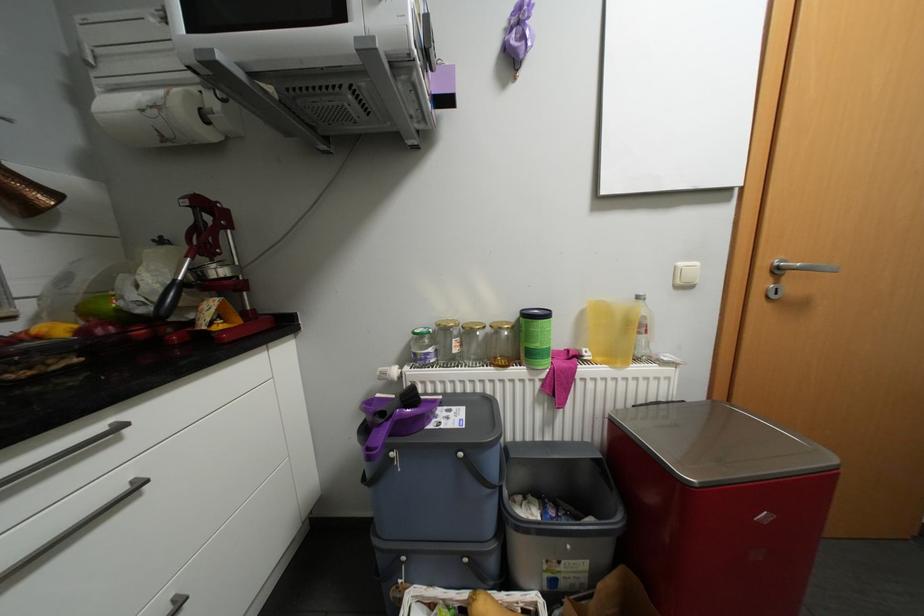
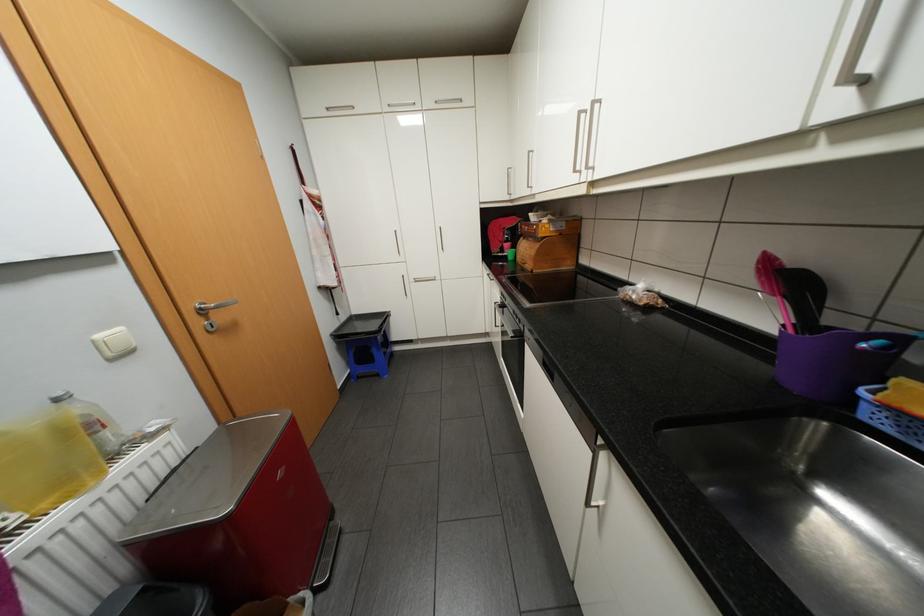
The point at (646, 297) is marked in the first image. Where is the corresponding point in the second image?

(65, 399)